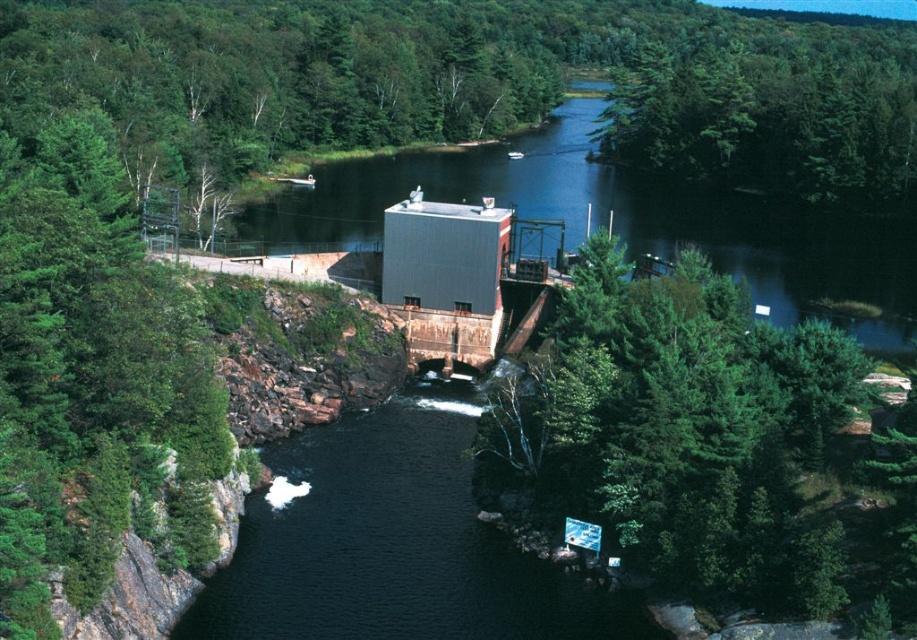
Question: Does green leafy tree at center have a smaller size compared to green leafy trees at upper right?

Choices:
 (A) yes
 (B) no

Answer: (A)

Question: Does green leafy tree at center have a larger size compared to smooth concrete dam at center?

Choices:
 (A) yes
 (B) no

Answer: (B)

Question: In this image, where is smooth concrete dam at center located relative to green leafy trees at upper right?

Choices:
 (A) above
 (B) below

Answer: (B)

Question: Which point is closer to the camera taking this photo?

Choices:
 (A) (843, 561)
 (B) (655, 112)

Answer: (A)

Question: Which object appears closest to the camera in this image?

Choices:
 (A) green leafy tree at center
 (B) green leafy trees at upper right
 (C) smooth concrete dam at center

Answer: (A)

Question: Which object is the closest to the smooth concrete dam at center?

Choices:
 (A) green leafy trees at upper right
 (B) green leafy tree at center

Answer: (B)